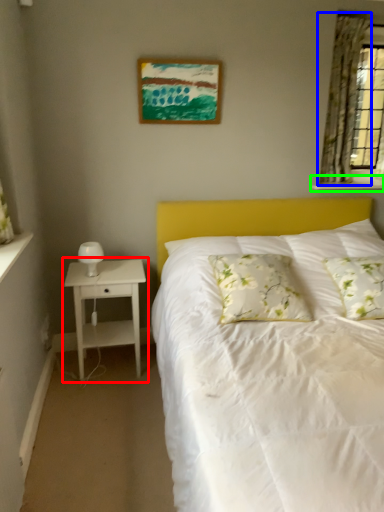
Question: Which object is positioned farthest from nightstand (highlighted by a red box)? Select from curtain (highlighted by a blue box) and window sill (highlighted by a green box).

Choices:
 (A) curtain
 (B) window sill

Answer: (A)